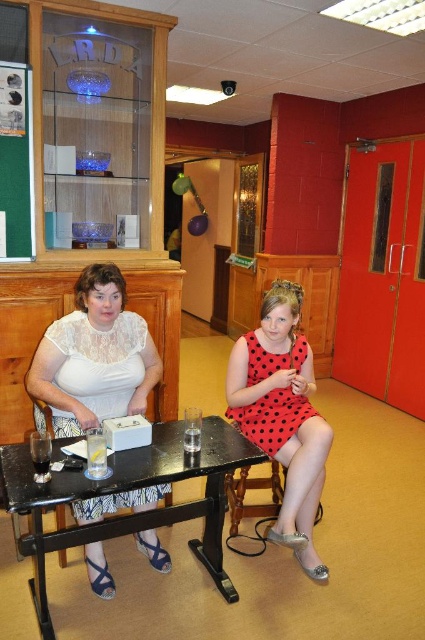
You are standing in the community hall and want to place a new item on the black wood table at center. What are the coordinates where you should place it?

The coordinates for placing the new item on the black wood table at center are at point (130, 490).

You are standing in front of the black wood table at center and the red dotted dress at center. Which object is closer to you?

The black wood table at center is closer to the viewer than the red dotted dress at center.

You are standing in the community hall and see the image. There is a white lace dress at center located at point (95, 356). Can you tell me what is at that exact point?

At point (95, 356) lies the white lace dress at center.